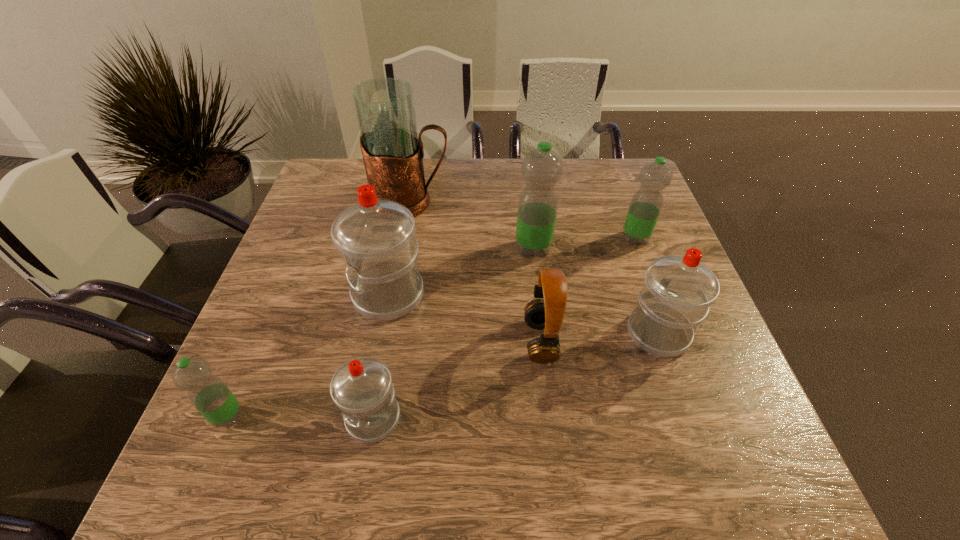
Find the location of `vacant point that satisfies the following two spatial constraints: 1. on the handle side of the rightmost white water bottle; 2. on the right side of the second biggest green water bottle`. vacant point that satisfies the following two spatial constraints: 1. on the handle side of the rightmost white water bottle; 2. on the right side of the second biggest green water bottle is located at coordinates (625, 238).

Find the location of `free space that satisfies the following two spatial constraints: 1. on the handle side of the biggest white water bottle; 2. on the front side of the leftmost green water bottle`. free space that satisfies the following two spatial constraints: 1. on the handle side of the biggest white water bottle; 2. on the front side of the leftmost green water bottle is located at coordinates [365, 416].

At what (x,y) coordinates should I click in order to perform the action: click on free space in the image that satisfies the following two spatial constraints: 1. on the handle side of the second biggest white water bottle; 2. on the right side of the second biggest green water bottle. Please return your answer as a coordinate pair (x, y). This screenshot has width=960, height=540. Looking at the image, I should click on (625, 238).

At what (x,y) coordinates should I click in order to perform the action: click on free space that satisfies the following two spatial constraints: 1. on the front side of the second green water bottle from right to left; 2. on the handle side of the biggest white water bottle. Please return your answer as a coordinate pair (x, y). The height and width of the screenshot is (540, 960). Looking at the image, I should click on (539, 295).